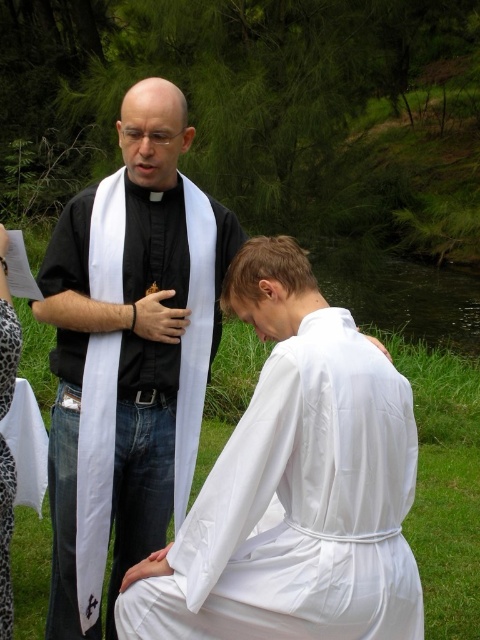
Question: Among these objects, which one is nearest to the camera?

Choices:
 (A) white cotton robe at lower center
 (B) black matte vestment at center

Answer: (A)

Question: Is white cotton robe at lower center wider than leopard print dress at lower left?

Choices:
 (A) no
 (B) yes

Answer: (B)

Question: Can you confirm if black matte vestment at center is bigger than leopard print dress at lower left?

Choices:
 (A) no
 (B) yes

Answer: (B)

Question: Which point is closer to the camera?

Choices:
 (A) click(x=9, y=481)
 (B) click(x=249, y=470)

Answer: (B)

Question: Does white cotton robe at lower center appear on the left side of black matte vestment at center?

Choices:
 (A) no
 (B) yes

Answer: (A)

Question: Which point is farther from the camera taking this photo?

Choices:
 (A) (387, 544)
 (B) (0, 456)

Answer: (B)